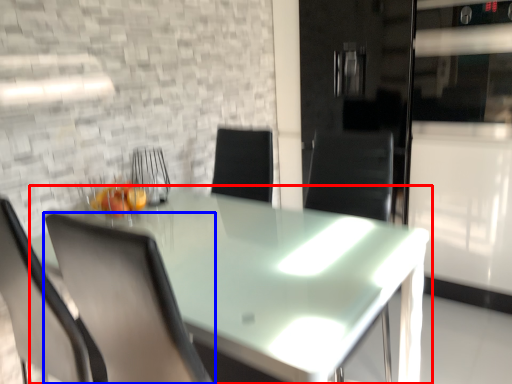
Question: Which point is closer to the camera, table (highlighted by a red box) or chair (highlighted by a blue box)?

Choices:
 (A) table
 (B) chair

Answer: (A)